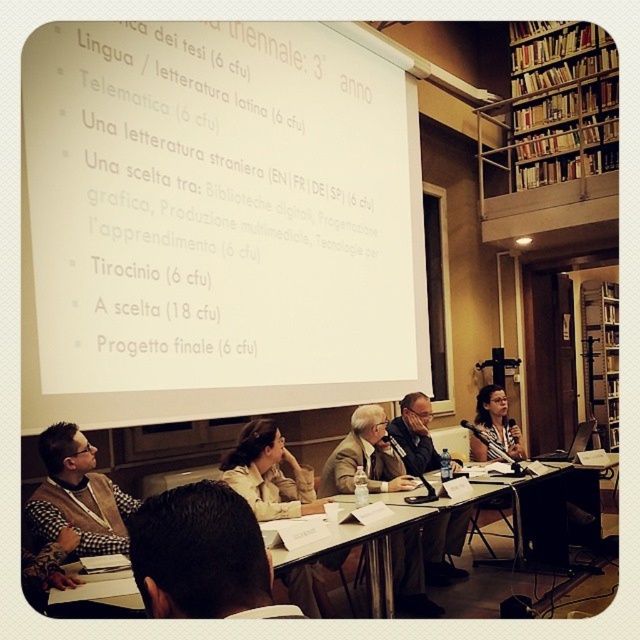
Between light brown leather jacket at center and matte black shirt at lower right, which one has more height?

Standing taller between the two is matte black shirt at lower right.

In the scene shown: Is light brown leather jacket at center wider than matte black shirt at lower right?

Yes, light brown leather jacket at center is wider than matte black shirt at lower right.

This screenshot has height=640, width=640. I want to click on light brown leather jacket at center, so coord(364,458).

Find the location of a particular element. light brown leather jacket at center is located at coordinates (364, 458).

Looking at this image, can you confirm if wooden table at center is bigger than wooden bookshelf at right?

Incorrect, wooden table at center is not larger than wooden bookshelf at right.

Measure the distance between point (x=552, y=540) and camera.

A distance of 4.45 meters exists between point (x=552, y=540) and camera.

Who is more distant from viewer, (122, 579) or (616, 412)?

The point (616, 412) is more distant.

At what (x,y) coordinates should I click in order to perform the action: click on wooden table at center. Please return your answer as a coordinate pair (x, y). The image size is (640, 640). Looking at the image, I should click on (545, 508).

Is point (500, 572) farther from camera compared to point (477, 456)?

No, it is not.

Where is `wooden table at center`? wooden table at center is located at coordinates (545, 508).

You are a GUI agent. You are given a task and a screenshot of the screen. Output one action in this format:
    pyautogui.click(x=<x>, y=<y>)
    Task: Click on the wooden table at center
    
    Given the screenshot: What is the action you would take?
    pyautogui.click(x=545, y=508)

Find the location of a particular element. This screenshot has width=640, height=640. wooden table at center is located at coordinates (545, 508).